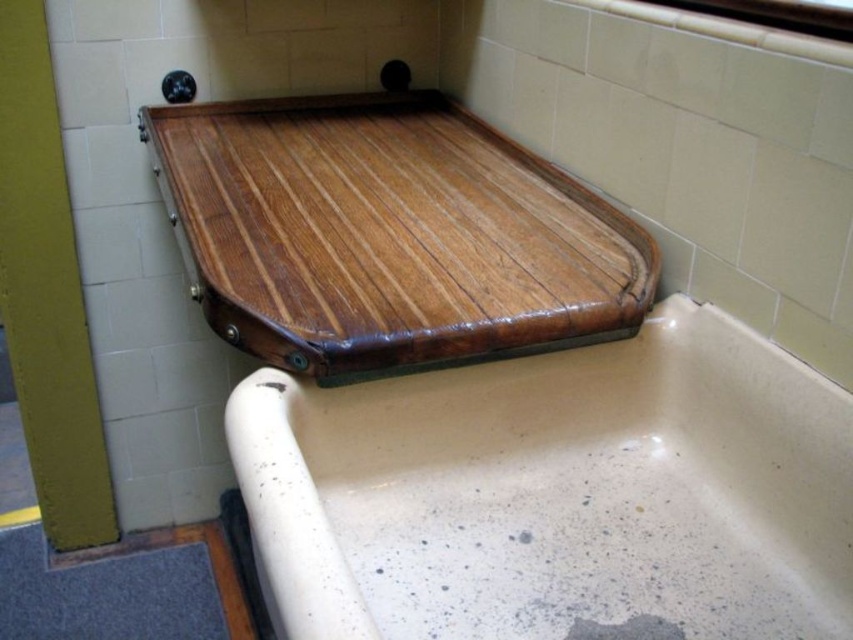
Does speckled ceramic bathtub at upper center come in front of wooden tray at upper center?

Yes, speckled ceramic bathtub at upper center is closer to the viewer.

Who is positioned more to the left, speckled ceramic bathtub at upper center or wooden tray at upper center?

From the viewer's perspective, wooden tray at upper center appears more on the left side.

This screenshot has width=853, height=640. What do you see at coordinates (556, 493) in the screenshot? I see `speckled ceramic bathtub at upper center` at bounding box center [556, 493].

This screenshot has width=853, height=640. I want to click on speckled ceramic bathtub at upper center, so click(x=556, y=493).